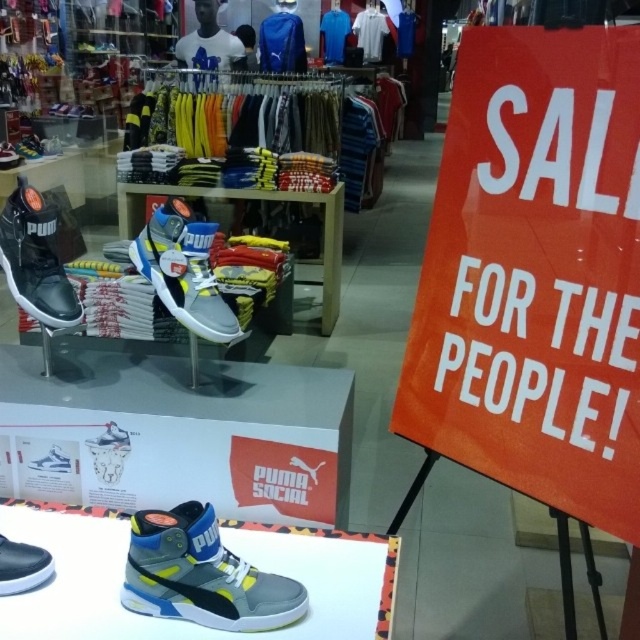
Question: Does orange paper sign at center right have a larger size compared to gray/yellow suede sneaker at center?

Choices:
 (A) no
 (B) yes

Answer: (B)

Question: Which object is closer to the camera taking this photo?

Choices:
 (A) gray matte sneaker at center
 (B) white matte shoe at center

Answer: (A)

Question: Which object appears closest to the camera in this image?

Choices:
 (A) black matte sneaker at left
 (B) white matte shoe at center
 (C) gray/yellow suede sneaker at center

Answer: (C)

Question: Does gray/yellow suede sneaker at center appear under black matte sneaker at left?

Choices:
 (A) yes
 (B) no

Answer: (A)

Question: Is orange paper sign at center right closer to the viewer compared to gray matte sneaker at center?

Choices:
 (A) no
 (B) yes

Answer: (B)

Question: Which object is the closest to the gray matte sneaker at center?

Choices:
 (A) white matte shoe at center
 (B) orange paper sign at center right
 (C) gray/yellow suede sneaker at center
 (D) black matte sneaker at left

Answer: (D)